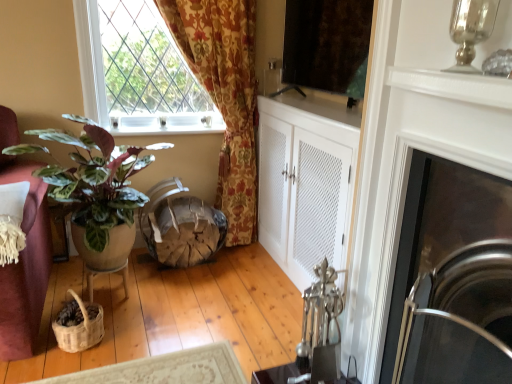
In order to click on matte black screen at upper center in this screenshot , I will do `click(327, 45)`.

This screenshot has width=512, height=384. What do you see at coordinates (327, 45) in the screenshot?
I see `matte black screen at upper center` at bounding box center [327, 45].

Measure the distance between matte terracotta pot at left and camera.

The depth of matte terracotta pot at left is 1.83 meters.

In order to face wooden table at lower left, should I rotate leftwards or rightwards?

To face it directly, rotate left by 19.019 degrees.

The image size is (512, 384). What do you see at coordinates (180, 227) in the screenshot? I see `wooden textured swivel chair at center` at bounding box center [180, 227].

Identify the location of matte black screen at upper center. The image size is (512, 384). (327, 45).

Is the position of matte terracotta pot at left less distant than that of matte black screen at upper center?

Yes.

Looking at this image, is matte terracotta pot at left bigger or smaller than matte black screen at upper center?

Clearly, matte terracotta pot at left is larger in size than matte black screen at upper center.

Considering the relative positions of matte terracotta pot at left and matte black screen at upper center in the image provided, is matte terracotta pot at left to the left or to the right of matte black screen at upper center?

Clearly, matte terracotta pot at left is on the left of matte black screen at upper center in the image.

From the image's perspective, which is above, matte terracotta pot at left or matte black screen at upper center?

matte black screen at upper center appears higher in the image.

Which is more distant, (x=105, y=270) or (x=361, y=83)?

The point (x=105, y=270) is more distant.

How distant is wooden table at lower left from matte black screen at upper center?

They are 1.59 meters apart.

Could you tell me if wooden table at lower left is facing matte black screen at upper center?

No.

Which object is thinner, wooden table at lower left or matte black screen at upper center?

With smaller width is matte black screen at upper center.

Is matte terracotta pot at left inside the boundaries of wooden textured swivel chair at center, or outside?

The correct answer is: outside.

Is matte terracotta pot at left behind wooden textured swivel chair at center?

That is False.

In the scene shown: Is wooden textured swivel chair at center at the back of matte terracotta pot at left?

No.

Who is bigger, matte terracotta pot at left or wooden table at lower left?

matte terracotta pot at left.

From the image's perspective, is matte terracotta pot at left located above wooden table at lower left?

Yes, from the image's perspective, matte terracotta pot at left is on top of wooden table at lower left.

Is wooden table at lower left at the back of matte terracotta pot at left?

No, matte terracotta pot at left is not facing away from wooden table at lower left.

In the scene shown: Which is behind, matte terracotta pot at left or wooden table at lower left?

wooden table at lower left is further from the camera.

Considering the positions of objects matte black screen at upper center and polished stainless steel fireplace at right in the image provided, who is more to the right, matte black screen at upper center or polished stainless steel fireplace at right?

polished stainless steel fireplace at right.

Could you tell me if matte black screen at upper center is turned towards polished stainless steel fireplace at right?

No, matte black screen at upper center is not turned towards polished stainless steel fireplace at right.

From a real-world perspective, is matte black screen at upper center positioned under polished stainless steel fireplace at right based on gravity?

No, from a real-world perspective, matte black screen at upper center is not under polished stainless steel fireplace at right.

Between matte black screen at upper center and polished stainless steel fireplace at right, which one is positioned behind?

matte black screen at upper center is further away from the camera.

Could you tell me if wooden table at lower left is turned towards polished stainless steel fireplace at right?

No, wooden table at lower left is not aimed at polished stainless steel fireplace at right.

Considering the sizes of wooden table at lower left and polished stainless steel fireplace at right in the image, is wooden table at lower left taller or shorter than polished stainless steel fireplace at right?

In the image, wooden table at lower left appears to be shorter than polished stainless steel fireplace at right.

Is wooden table at lower left completely or partially outside of polished stainless steel fireplace at right?

wooden table at lower left is positioned outside polished stainless steel fireplace at right.

Is polished stainless steel fireplace at right turned away from wooden table at lower left?

No, wooden table at lower left is not at the back of polished stainless steel fireplace at right.

From the image's perspective, would you say polished stainless steel fireplace at right is shown under wooden table at lower left?

Incorrect, from the image's perspective, polished stainless steel fireplace at right is higher than wooden table at lower left.

In the image, is polished stainless steel fireplace at right positioned in front of or behind wooden table at lower left?

Visually, polished stainless steel fireplace at right is located in front of wooden table at lower left.

Is point (471, 161) behind point (125, 296)?

No, (471, 161) is closer to viewer.

Where is `houseplant in front of the matte black screen at upper center`? houseplant in front of the matte black screen at upper center is located at coordinates (95, 180).

Locate an element on the screen. The height and width of the screenshot is (384, 512). table below the matte black screen at upper center (from a real-world perspective) is located at coordinates (106, 273).

When comparing their distances from matte black screen at upper center, does wooden textured swivel chair at center or matte terracotta pot at left seem further?

matte terracotta pot at left.

Looking at the image, which one is located further to matte terracotta pot at left, polished stainless steel fireplace at right or wooden table at lower left?

Among the two, polished stainless steel fireplace at right is located further to matte terracotta pot at left.

Looking at this image, estimate the real-world distances between objects in this image. Which object is further from matte black screen at upper center, matte terracotta pot at left or wooden table at lower left?

wooden table at lower left is further to matte black screen at upper center.

When comparing their distances from matte black screen at upper center, does polished stainless steel fireplace at right or matte terracotta pot at left seem further?

matte terracotta pot at left.

Based on their spatial positions, is matte black screen at upper center or matte terracotta pot at left further from wooden textured swivel chair at center?

matte black screen at upper center is positioned further to the anchor wooden textured swivel chair at center.

Looking at the image, which one is located closer to wooden textured swivel chair at center, polished stainless steel fireplace at right or wooden table at lower left?

Based on the image, wooden table at lower left appears to be nearer to wooden textured swivel chair at center.

When comparing their distances from matte terracotta pot at left, does wooden textured swivel chair at center or wooden table at lower left seem closer?

wooden table at lower left is positioned closer to the anchor matte terracotta pot at left.

Which object lies further to the anchor point polished stainless steel fireplace at right, wooden table at lower left or matte black screen at upper center?

wooden table at lower left lies further to polished stainless steel fireplace at right than the other object.

Find the location of a particular element. swivel chair between matte black screen at upper center and wooden table at lower left in the vertical direction is located at coordinates 180,227.

This screenshot has width=512, height=384. What are the coordinates of `window screen between polished stainless steel fireplace at right and wooden textured swivel chair at center along the z-axis` in the screenshot? It's located at (327, 45).

Image resolution: width=512 pixels, height=384 pixels. I want to click on table between matte terracotta pot at left and matte black screen at upper center from left to right, so click(x=106, y=273).

The image size is (512, 384). I want to click on table between matte terracotta pot at left and polished stainless steel fireplace at right, so click(106, 273).